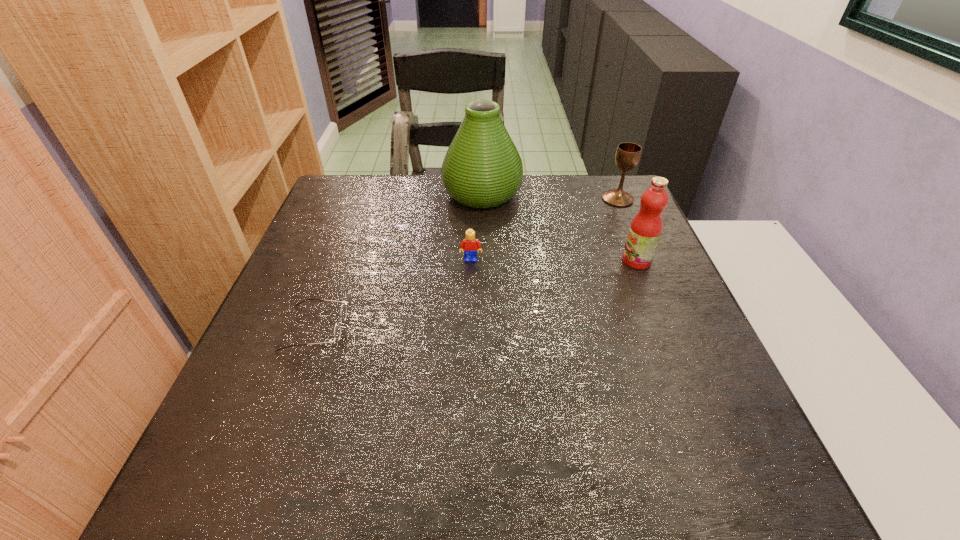
I want to click on vacant space at the near edge of the desktop, so click(552, 461).

You are a GUI agent. You are given a task and a screenshot of the screen. Output one action in this format:
    pyautogui.click(x=<x>, y=<y>)
    Task: Click on the vacant space at the left edge of the desktop
    This screenshot has width=960, height=540.
    Given the screenshot: What is the action you would take?
    pyautogui.click(x=283, y=302)

This screenshot has height=540, width=960. Identify the location of vacant area at the right edge. (734, 441).

In the image, there is a desktop. Identify the location of vacant region at the near right corner. The width and height of the screenshot is (960, 540). coord(661,456).

You are a GUI agent. You are given a task and a screenshot of the screen. Output one action in this format:
    pyautogui.click(x=<x>, y=<y>)
    Task: Click on the free point between the fourth shortest object and the spectacles
    This screenshot has width=960, height=540.
    Given the screenshot: What is the action you would take?
    [x=476, y=294]

Where is `empty space that is in between the chalice and the leftmost object`? The height and width of the screenshot is (540, 960). empty space that is in between the chalice and the leftmost object is located at coordinates (467, 264).

In order to click on vacant region between the chalice and the Lego in this screenshot , I will do `click(544, 230)`.

Locate an element on the screen. This screenshot has width=960, height=540. empty space between the third tallest object and the nearest object is located at coordinates (467, 264).

At what (x,y) coordinates should I click in order to perform the action: click on empty space that is in between the fruit juice and the second shortest object. Please return your answer as a coordinate pair (x, y). Looking at the image, I should click on (554, 260).

Image resolution: width=960 pixels, height=540 pixels. Identify the location of free space between the fruit juice and the spectacles. (476, 294).